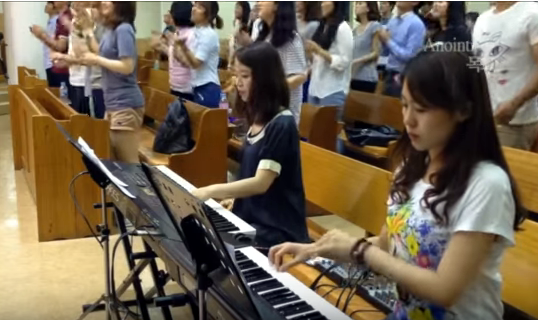
Find the location of a particular element. piano is located at coordinates (313, 295), (215, 207).